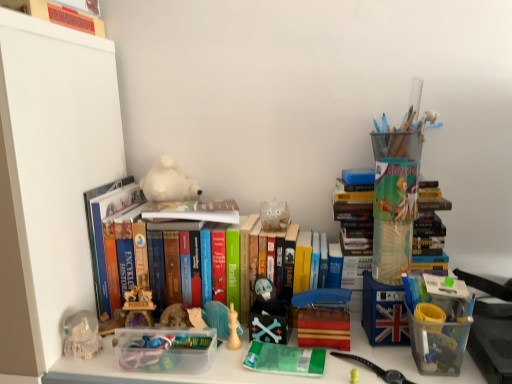
Question: Is the depth of hardcover books at center, which is counted as the third book, starting from the top, greater than that of matte black skull at center, positioned as the 2th toy in top-to-bottom order?

Choices:
 (A) yes
 (B) no

Answer: (B)

Question: Is hardcover books at center, the 1th book from the bottom, touching matte black skull at center, which is the first toy from right to left?

Choices:
 (A) no
 (B) yes

Answer: (A)

Question: From the image's perspective, would you say hardcover books at center, which is counted as the third book, starting from the top, is shown under matte black skull at center, the 1th toy when ordered from front to back?

Choices:
 (A) yes
 (B) no

Answer: (B)

Question: Is hardcover books at center, which is counted as the third book, starting from the top, not within matte black skull at center, positioned as the 2th toy in top-to-bottom order?

Choices:
 (A) no
 (B) yes

Answer: (B)

Question: Is hardcover books at center, the 1th book from the bottom, looking in the opposite direction of matte black skull at center, which is the 1th toy from bottom to top?

Choices:
 (A) yes
 (B) no

Answer: (B)

Question: From a real-world perspective, is hardcover books at center, the 1th book from the bottom, physically below matte black skull at center, which is the 1th toy from bottom to top?

Choices:
 (A) no
 (B) yes

Answer: (A)

Question: Would you say hardcover books at center, the 1th book from the bottom, contains white plush bear at center, the 2th toy from the right?

Choices:
 (A) no
 (B) yes

Answer: (B)

Question: From the image's perspective, is hardcover books at center, which is counted as the third book, starting from the top, beneath white plush bear at center, which ranks as the 1th toy in back-to-front order?

Choices:
 (A) no
 (B) yes

Answer: (B)

Question: From a real-world perspective, is hardcover books at center, which is counted as the third book, starting from the top, located beneath white plush bear at center, the 1th toy from the left?

Choices:
 (A) no
 (B) yes

Answer: (B)

Question: Does hardcover books at center, the 1th book from the bottom, have a greater width compared to white plush bear at center, acting as the second toy starting from the bottom?

Choices:
 (A) yes
 (B) no

Answer: (A)

Question: Is hardcover books at center, the 1th book from the bottom, smaller than white plush bear at center, the first toy from the top?

Choices:
 (A) yes
 (B) no

Answer: (B)

Question: Does hardcover books at center, the 1th book from the bottom, appear on the right side of white plush bear at center, which ranks as the 1th toy in back-to-front order?

Choices:
 (A) no
 (B) yes

Answer: (B)

Question: Can you confirm if white plush bear at center, the 1th toy from the left, is thinner than hardcover book at center, the second book positioned from the bottom?

Choices:
 (A) yes
 (B) no

Answer: (A)